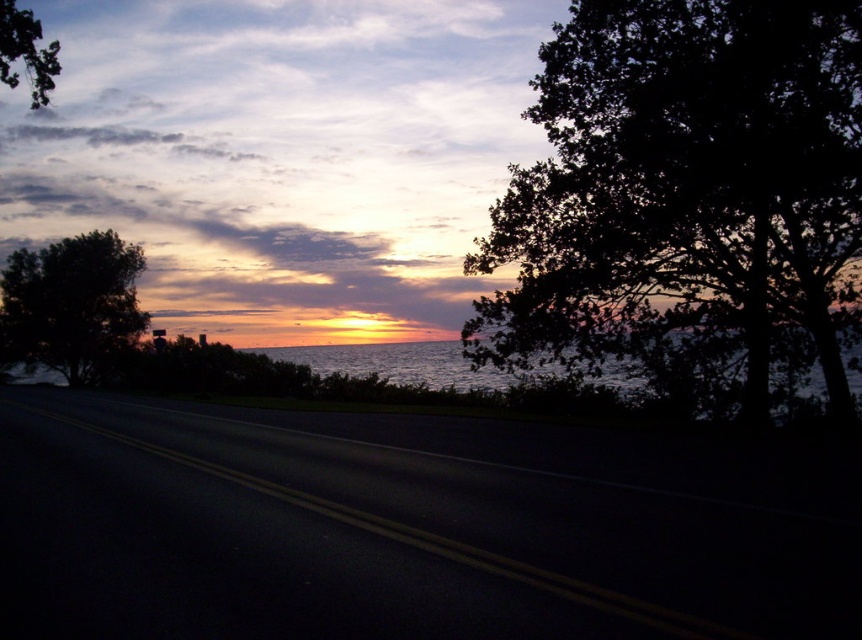
Question: Among these points, which one is nearest to the camera?

Choices:
 (A) (16, 77)
 (B) (335, 348)
 (C) (847, 285)

Answer: (C)

Question: Does green leafy tree at left have a larger size compared to shimmering silver water at center?

Choices:
 (A) yes
 (B) no

Answer: (A)

Question: Which point is closer to the camera?

Choices:
 (A) (348, 480)
 (B) (27, 19)
 (C) (25, 353)
 (D) (426, 371)

Answer: (A)

Question: Does green leafy tree at left appear over shimmering silver water at center?

Choices:
 (A) no
 (B) yes

Answer: (B)

Question: Does black asphalt highway at center lie in front of green leafy tree at left?

Choices:
 (A) no
 (B) yes

Answer: (B)

Question: Among these points, which one is nearest to the camera?

Choices:
 (A) (550, 323)
 (B) (336, 346)
 (C) (22, 260)

Answer: (A)